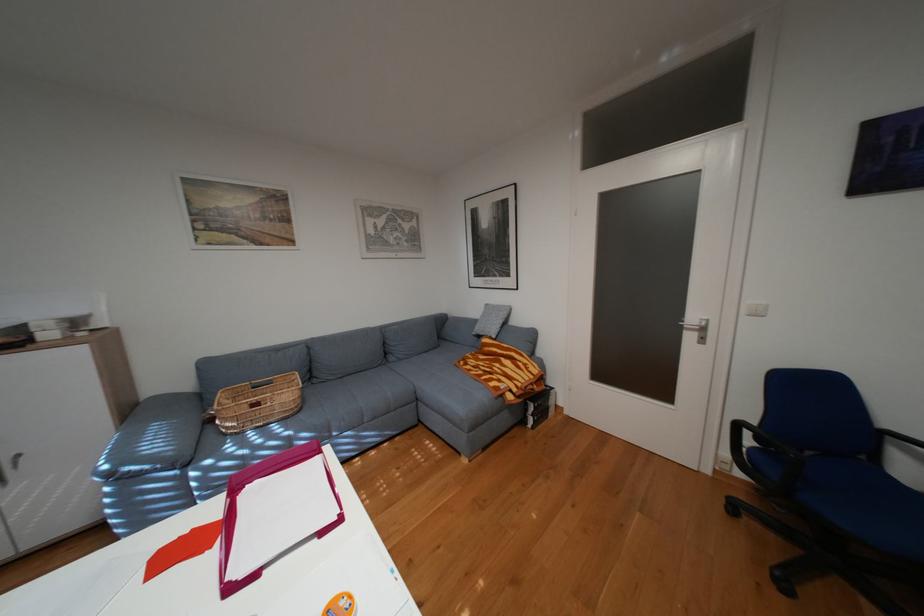
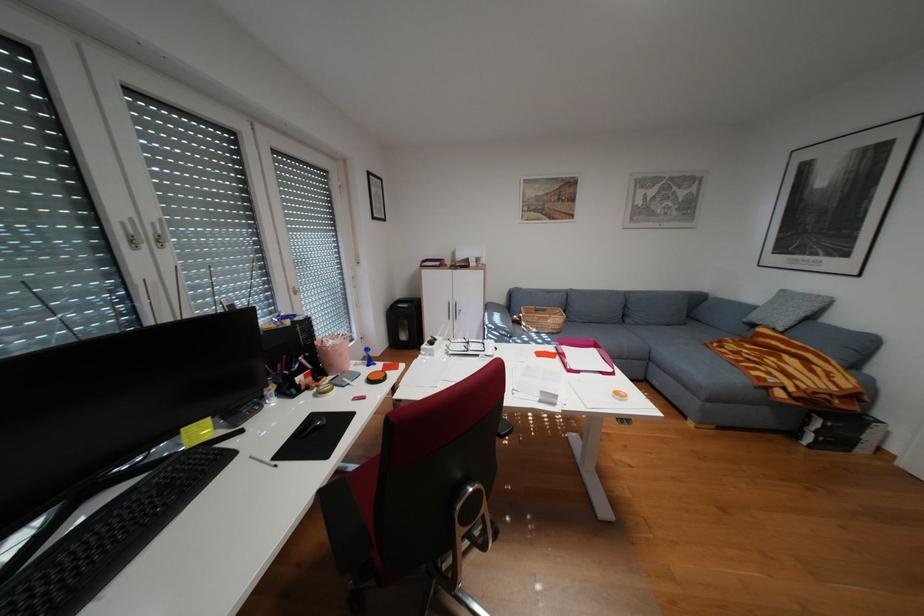
The point at [512,379] is marked in the first image. Where is the corresponding point in the second image?

(782, 373)